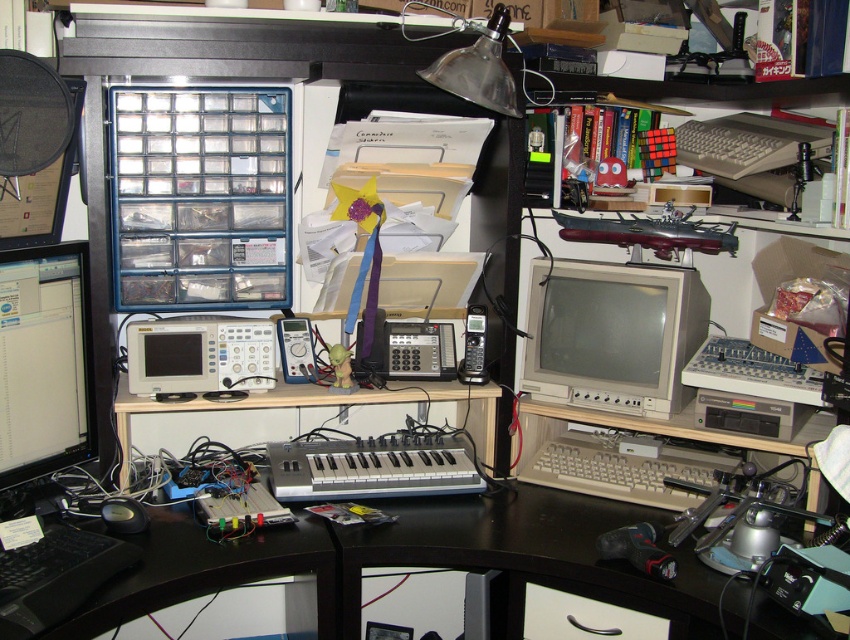
You are setting up a cable that needs to be 4 feet long to connect the beige plastic monitor at center and the matte black monitor at left. Is the cable long enough?

The distance between the beige plastic monitor at center and the matte black monitor at left is 3.84 feet, so the 4 feet cable is long enough to connect them.

You are a photographer standing at the center of the workspace. You need to take a photo that includes both the point at coordinates point (592, 278) and point (34, 284). Which point should you focus on first to ensure both are in focus?

You should focus on point (592, 278) first because it is closer to the camera than point (34, 284). By focusing on the closer point, the farther point will also be within the depth of field.

You are organizing the desk and want to move the beige plastic keyboard at lower center to the right side of the matte black monitor at left. Is this possible without moving the monitor?

The matte black monitor at left is in front of the beige plastic keyboard at lower center, so moving the beige plastic keyboard at lower center to the right side of the matte black monitor at left would require moving the monitor first to access the keyboard.